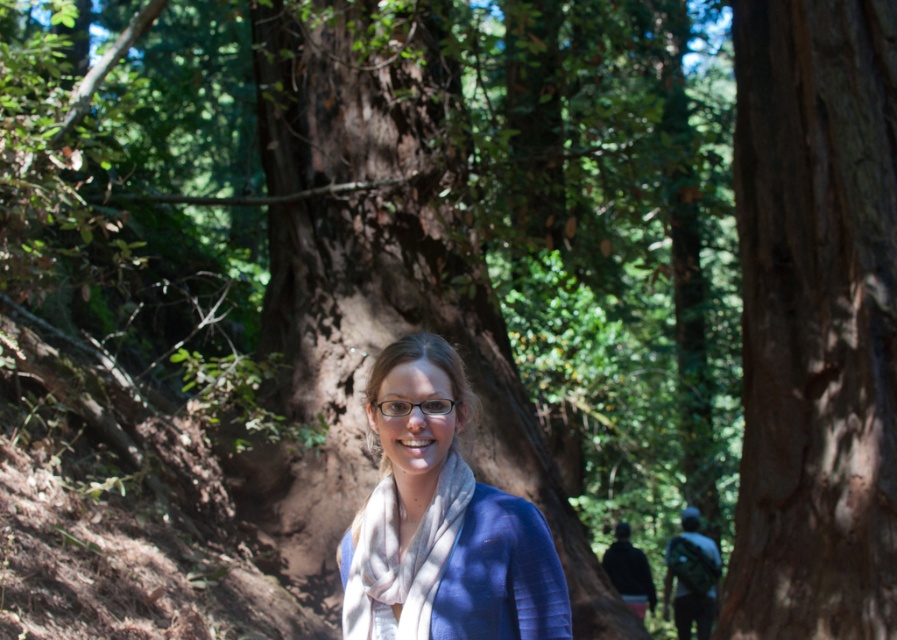
Does point (776, 113) come closer to viewer compared to point (434, 448)?

No, it is behind (434, 448).

This screenshot has width=897, height=640. What do you see at coordinates (815, 320) in the screenshot? I see `brown rough bark tree at center` at bounding box center [815, 320].

This screenshot has width=897, height=640. What are the coordinates of `brown rough bark tree at center` in the screenshot? It's located at (815, 320).

Which is in front, point (767, 490) or point (353, 582)?

Point (353, 582)

Does brown rough bark tree at center come in front of white soft scarf at center?

No, it is not.

Identify the location of brown rough bark tree at center. (815, 320).

Where is `brown rough bark tree at center`? The image size is (897, 640). brown rough bark tree at center is located at coordinates (815, 320).

Can you confirm if blue matte scarf at center is thinner than white soft scarf at center?

In fact, blue matte scarf at center might be wider than white soft scarf at center.

Does blue matte scarf at center appear under white soft scarf at center?

Actually, blue matte scarf at center is above white soft scarf at center.

Is point (482, 577) more distant than point (440, 556)?

No.

Where is `blue matte scarf at center`? blue matte scarf at center is located at coordinates (443, 518).